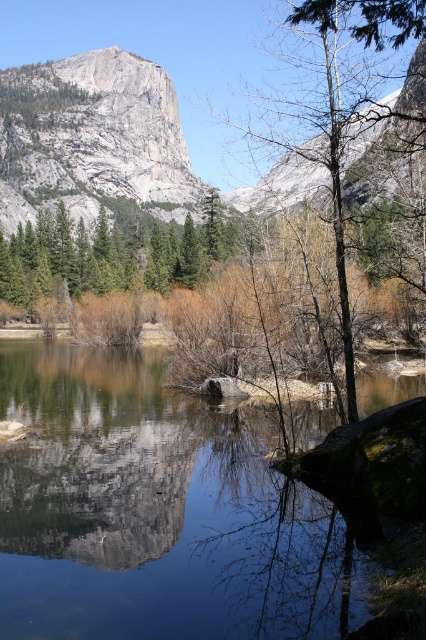
You are standing at the point marked as point (x=157, y=509) in the image. What is the object directly beneath your feet?

The transparent water at center is located at point (x=157, y=509), so the object directly beneath your feet is transparent water at center.

You are an environmental scientist analyzing the image. You need to determine which object takes up more area in the scene between the transparent water at center and the green matte tree at center. Which one has a larger area?

The green matte tree at center occupies more area than the transparent water at center according to the description.

You are standing at the edge of the lake and see two points in the image. The first point is at coordinates point (181, 560) and the second is at point (190, 237). Which point is closer to you?

Point (181, 560) is closer to the camera than point (190, 237).